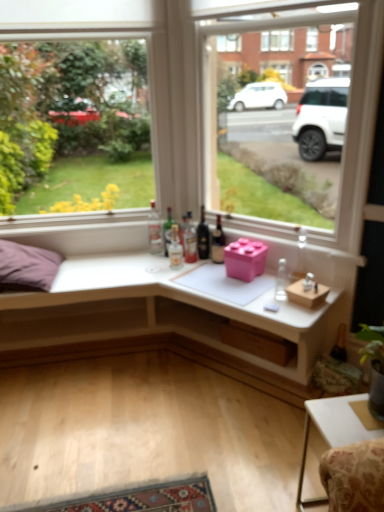
Identify the location of free point below white matte desk at center (from a real-world perspective). (139, 379).